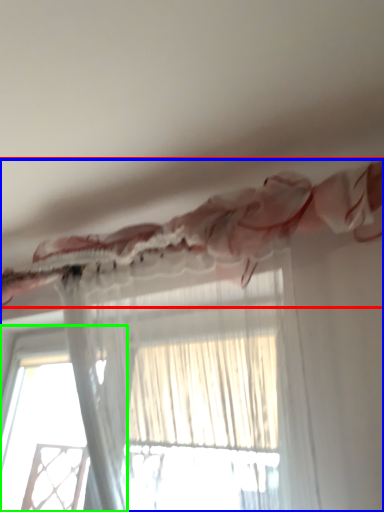
Question: Which is farther away from curtain (highlighted by a red box)? curtain (highlighted by a blue box) or window (highlighted by a green box)?

Choices:
 (A) curtain
 (B) window

Answer: (B)